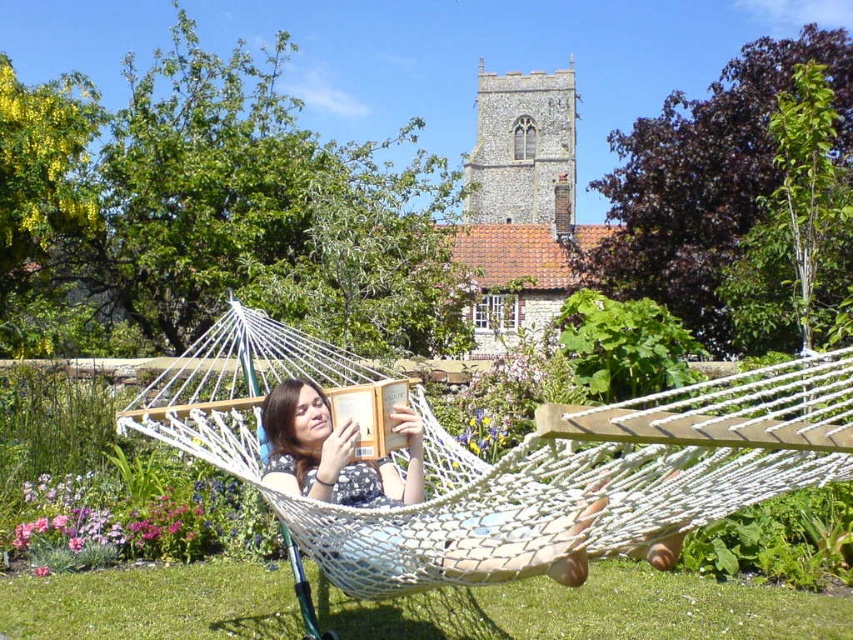
Question: Is white mesh hammock at center to the left of polka dot dress at center from the viewer's perspective?

Choices:
 (A) no
 (B) yes

Answer: (B)

Question: Which of the following is the farthest from the observer?

Choices:
 (A) white mesh hammock at center
 (B) polka dot dress at center

Answer: (B)

Question: Can you confirm if white mesh hammock at center is wider than polka dot dress at center?

Choices:
 (A) no
 (B) yes

Answer: (B)

Question: Is white mesh hammock at center behind polka dot dress at center?

Choices:
 (A) yes
 (B) no

Answer: (B)